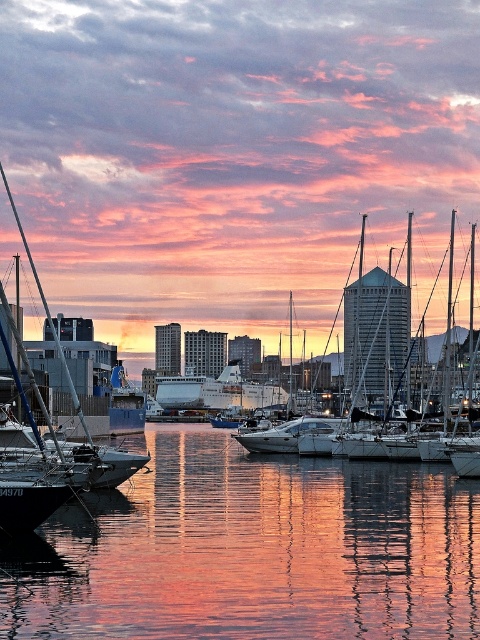
You are standing at the harbor and want to take a photo that includes both point marked at coordinates point (392, 401) and point marked at coordinates point (177, 406). Which point will appear larger in the photo?

Point (392, 401) is closer to the camera than point (177, 406), so it will appear larger in the photo.

You are standing at the point marked by the coordinates point (377, 337). Looking around, you see a white glossy sailboat at center. Which direction should you walk to reach the cruise ship docked near the center?

The point (377, 337) marks the white glossy sailboat at center, so you are already at the location of the white glossy sailboat at center. Therefore, you don not need to move to reach it.